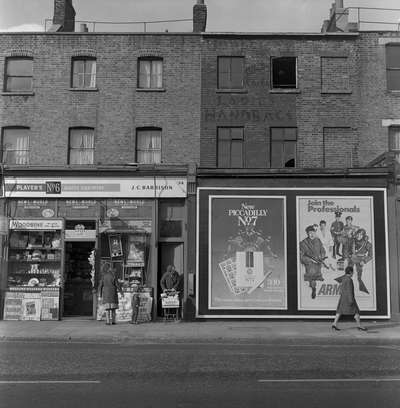
Locate an element on the screen. This screenshot has width=400, height=408. the first doorway on the left of the store on the left is located at coordinates (72, 272).